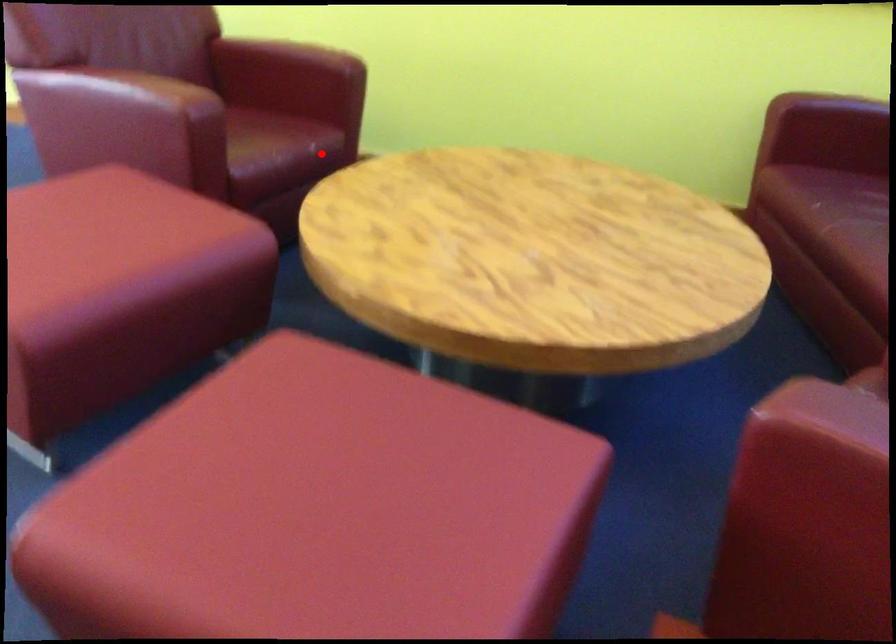
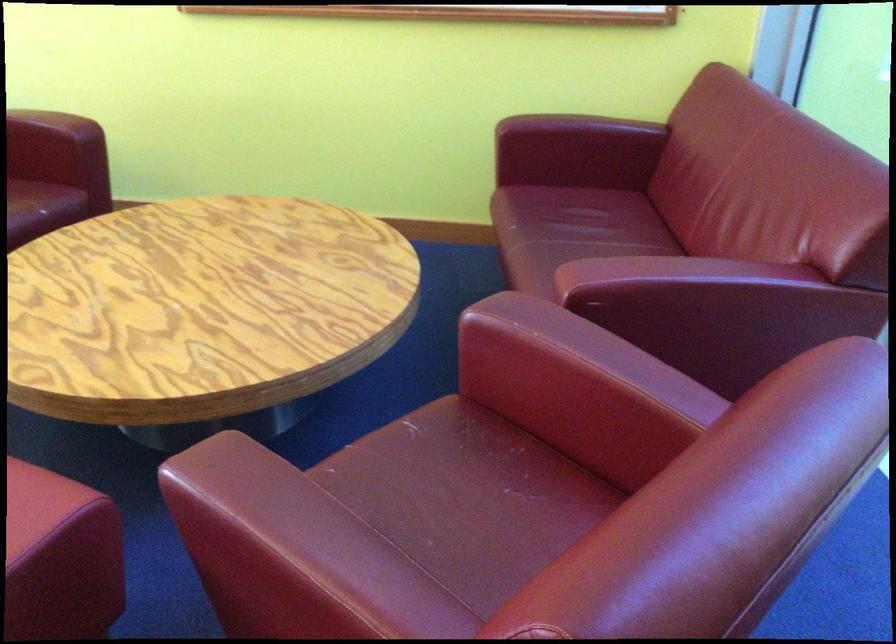
Locate, in the second image, the point that corresponds to the highlighted location in the first image.

(46, 209)